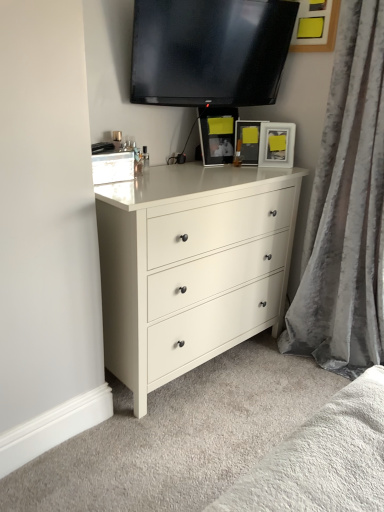
Locate an element on the screen. free location to the right of matte black picture frame at upper center, marked as the first picture frame in a left-to-right arrangement is located at coordinates (249, 166).